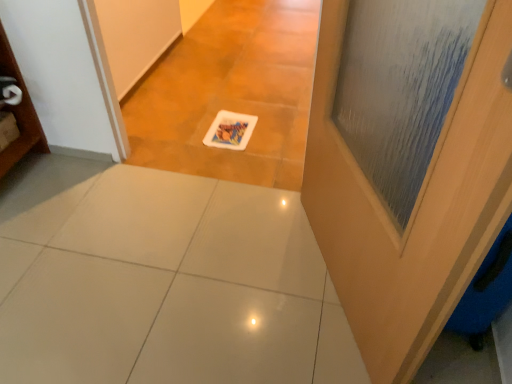
Question: From the image's perspective, is wooden door at right above or below white glossy tile at center?

Choices:
 (A) above
 (B) below

Answer: (A)

Question: Is wooden door at right inside the boundaries of white glossy tile at center, or outside?

Choices:
 (A) outside
 (B) inside

Answer: (A)

Question: Is point (409, 62) closer or farther from the camera than point (75, 352)?

Choices:
 (A) closer
 (B) farther

Answer: (A)

Question: Which is correct: white glossy tile at center is inside wooden door at right, or outside of it?

Choices:
 (A) inside
 (B) outside

Answer: (B)

Question: From a real-world perspective, is white glossy tile at center physically located above or below wooden door at right?

Choices:
 (A) below
 (B) above

Answer: (A)

Question: Considering the positions of white glossy tile at center and wooden door at right in the image, is white glossy tile at center wider or thinner than wooden door at right?

Choices:
 (A) wide
 (B) thin

Answer: (A)

Question: From the image's perspective, is white glossy tile at center located above or below wooden door at right?

Choices:
 (A) below
 (B) above

Answer: (A)